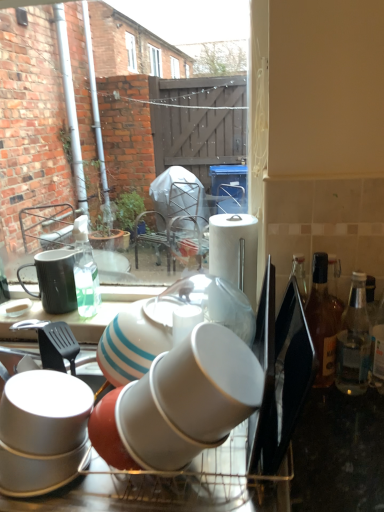
Identify the location of vacant space in front of translucent glass bottle at right, placed as the first bottle when sorted from left to right. This screenshot has height=512, width=384. (334, 430).